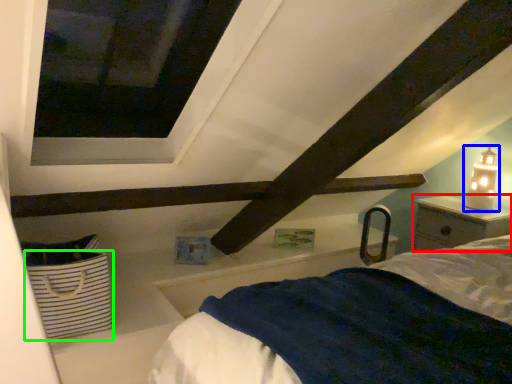
Question: Based on their relative distances, which object is farther from nightstand (highlighted by a red box)? Choose from table lamp (highlighted by a blue box) and basket (highlighted by a green box).

Choices:
 (A) table lamp
 (B) basket

Answer: (B)